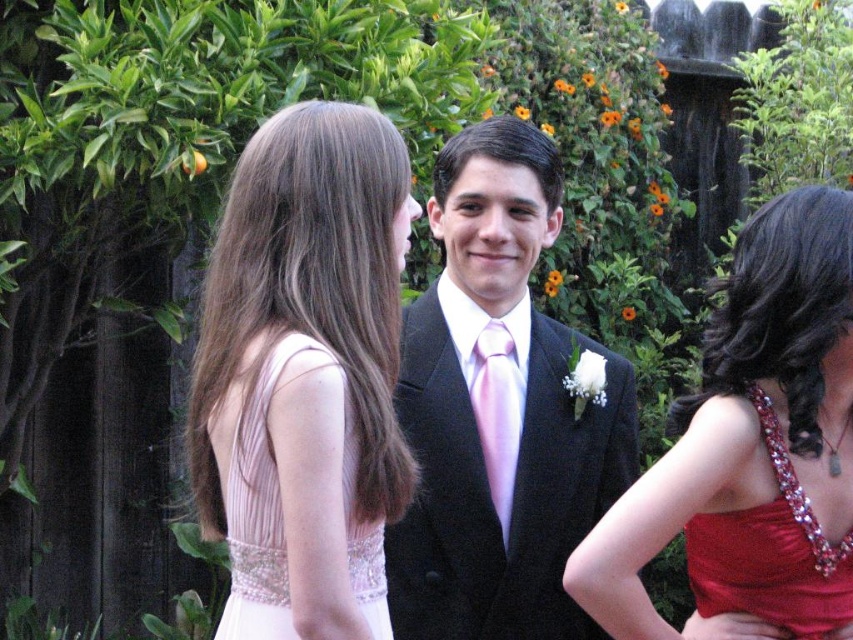
Can you confirm if pink satin dress at upper left is positioned to the left of pink satin tie at center?

Indeed, pink satin dress at upper left is positioned on the left side of pink satin tie at center.

Is point (279, 125) closer to camera compared to point (505, 403)?

Yes, point (279, 125) is in front of point (505, 403).

Find the location of a particular element. This screenshot has height=640, width=853. pink satin dress at upper left is located at coordinates (305, 372).

Which is more to the right, black velvet suit at center or shiny red dress at center?

From the viewer's perspective, shiny red dress at center appears more on the right side.

In the scene shown: Does black velvet suit at center have a greater height compared to shiny red dress at center?

Yes.

Between point (498, 339) and point (840, 589), which one is positioned behind?

The point (498, 339) is behind.

I want to click on black velvet suit at center, so click(x=498, y=410).

Is pink satin dress at upper left smaller than pink satin dress at left?

No, pink satin dress at upper left is not smaller than pink satin dress at left.

Is pink satin dress at upper left to the right of pink satin dress at left from the viewer's perspective?

In fact, pink satin dress at upper left is to the left of pink satin dress at left.

Measure the distance between point (239, 296) and camera.

Point (239, 296) and camera are 10.99 feet apart.

Identify the location of pink satin dress at upper left. This screenshot has width=853, height=640. (305, 372).